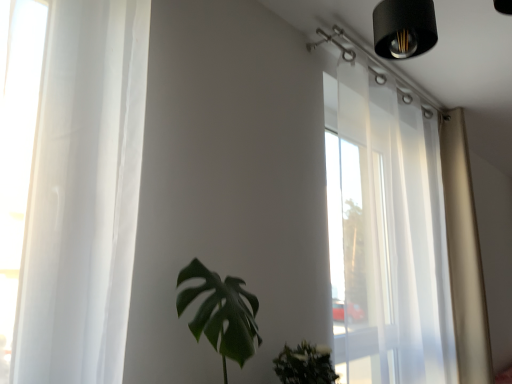
Question: Does green matte leafy plant at center come behind beige fabric curtain at right?

Choices:
 (A) no
 (B) yes

Answer: (A)

Question: Does green matte leafy plant at center have a greater width compared to beige fabric curtain at right?

Choices:
 (A) no
 (B) yes

Answer: (B)

Question: Is green matte leafy plant at center smaller than beige fabric curtain at right?

Choices:
 (A) yes
 (B) no

Answer: (A)

Question: Is beige fabric curtain at right completely or partially inside green matte leafy plant at center?

Choices:
 (A) yes
 (B) no

Answer: (B)

Question: Does green matte leafy plant at center turn towards beige fabric curtain at right?

Choices:
 (A) yes
 (B) no

Answer: (B)

Question: Is green matte leafy plant at center at the left side of beige fabric curtain at right?

Choices:
 (A) no
 (B) yes

Answer: (B)

Question: Is transparent curtain at upper right smaller than beige fabric curtain at right?

Choices:
 (A) yes
 (B) no

Answer: (B)

Question: Is transparent curtain at upper right further to the viewer compared to beige fabric curtain at right?

Choices:
 (A) no
 (B) yes

Answer: (A)

Question: Does transparent curtain at upper right have a greater height compared to beige fabric curtain at right?

Choices:
 (A) yes
 (B) no

Answer: (B)

Question: Is transparent curtain at upper right facing away from beige fabric curtain at right?

Choices:
 (A) no
 (B) yes

Answer: (A)

Question: Is transparent curtain at upper right shorter than beige fabric curtain at right?

Choices:
 (A) no
 (B) yes

Answer: (B)

Question: From a real-world perspective, is transparent curtain at upper right on top of beige fabric curtain at right?

Choices:
 (A) yes
 (B) no

Answer: (A)

Question: Considering the relative positions of green matte leafy plant at center and transparent curtain at upper right in the image provided, is green matte leafy plant at center to the right of transparent curtain at upper right from the viewer's perspective?

Choices:
 (A) no
 (B) yes

Answer: (A)